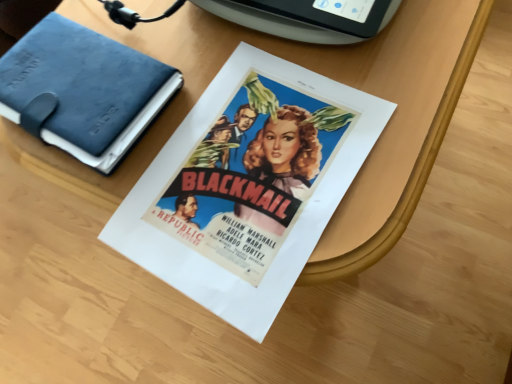
You are a GUI agent. You are given a task and a screenshot of the screen. Output one action in this format:
    pyautogui.click(x=<x>, y=<y>)
    Task: Click on the free location in front of matte blue notebook at upper left
    
    Given the screenshot: What is the action you would take?
    pyautogui.click(x=175, y=196)